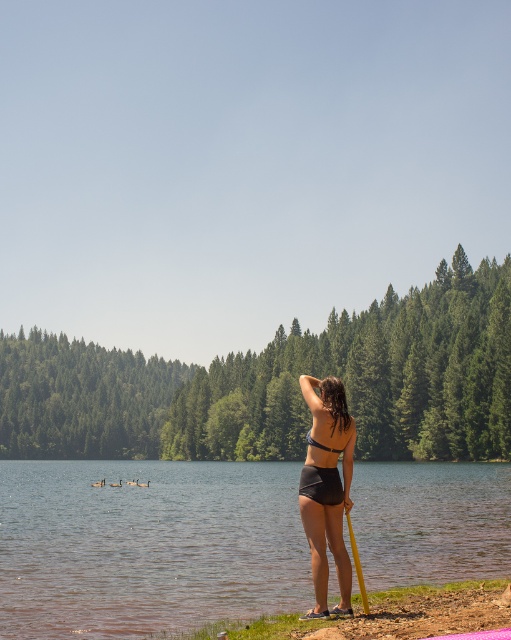
Question: Is clear water at shore right below yellow plastic pole at lower center?

Choices:
 (A) no
 (B) yes

Answer: (B)

Question: Can you confirm if matte black bikini at center is bigger than yellow plastic pole at lower center?

Choices:
 (A) no
 (B) yes

Answer: (B)

Question: Is matte black bikini at center positioned behind yellow plastic pole at lower center?

Choices:
 (A) no
 (B) yes

Answer: (B)

Question: Which is farther from the clear water at shore right?

Choices:
 (A) matte black bikini at center
 (B) yellow plastic pole at lower center

Answer: (B)

Question: Which of the following is the farthest from the observer?

Choices:
 (A) (359, 576)
 (B) (320, 605)

Answer: (A)

Question: Which point is closer to the camera?

Choices:
 (A) clear water at shore right
 (B) yellow plastic pole at lower center
 (C) matte black bikini at center

Answer: (B)